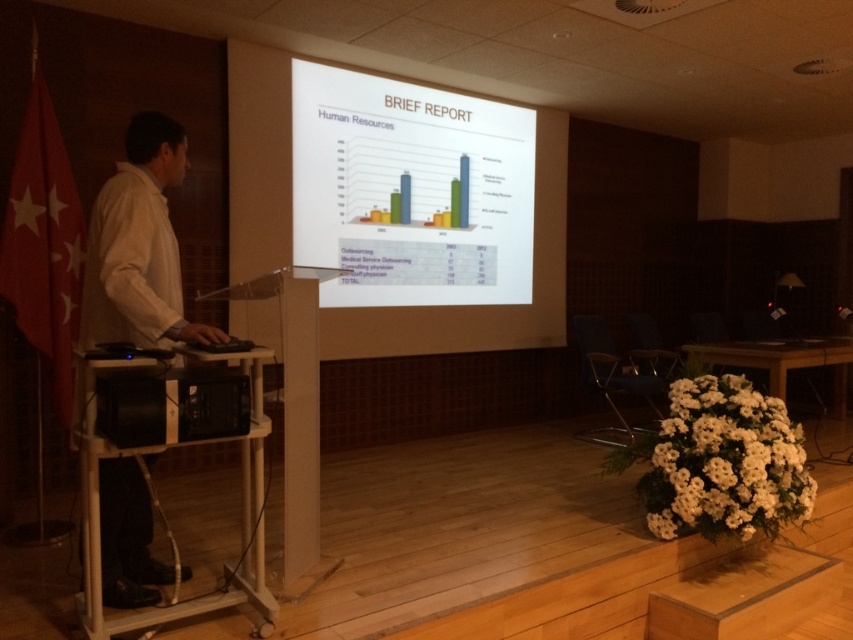
Question: Does white shirt at left appear under wooden podium at center?

Choices:
 (A) no
 (B) yes

Answer: (A)

Question: Does white glossy projector screen at upper center have a greater width compared to black plastic speaker at lower left?

Choices:
 (A) yes
 (B) no

Answer: (A)

Question: Among these objects, which one is nearest to the camera?

Choices:
 (A) wooden podium at center
 (B) black plastic speaker at lower left

Answer: (B)

Question: Where is white shirt at left located in relation to black plastic speaker at lower left in the image?

Choices:
 (A) below
 (B) above

Answer: (B)

Question: Which object appears farthest from the camera in this image?

Choices:
 (A) wooden podium at center
 (B) black plastic speaker at lower left
 (C) white glossy projector screen at upper center
 (D) white shirt at left

Answer: (C)

Question: Which object is farther from the camera taking this photo?

Choices:
 (A) white glossy projector screen at upper center
 (B) wooden podium at center
 (C) black plastic speaker at lower left
 (D) white shirt at left

Answer: (A)